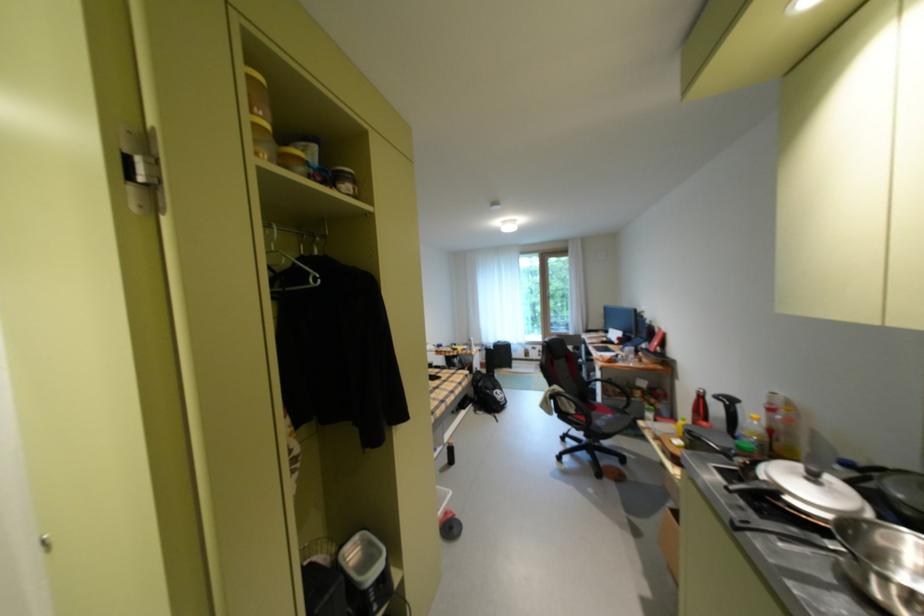
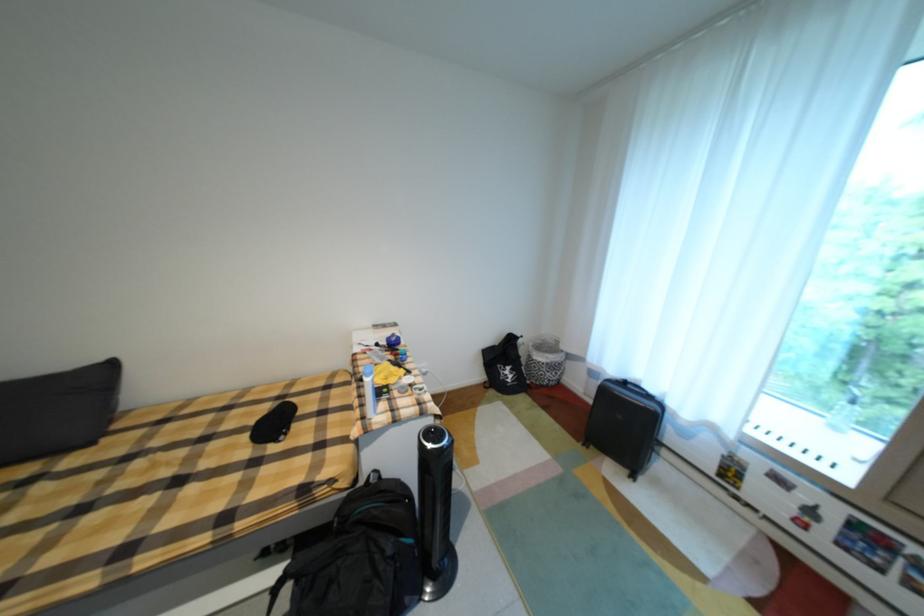
The point at (x=508, y=342) is marked in the first image. Where is the corresponding point in the second image?

(635, 384)